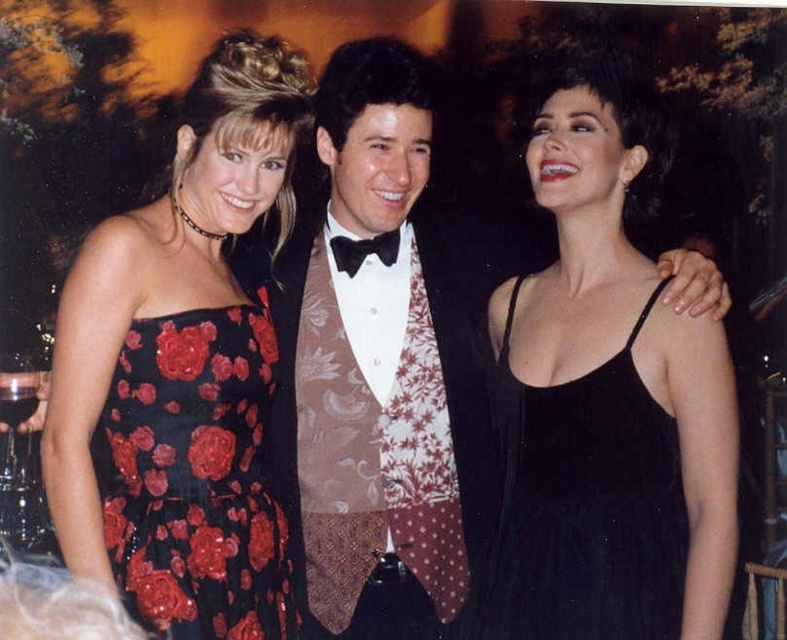
You are a photographer at the event and need to adjust the lighting to ensure both the black satin dress at center and the black velvet dress at center are visible. Which dress requires more light due to its material properties?

The black satin dress at center requires more light because satin reflects more light than velvet, making it appear brighter and thus needing less additional light to be visible. However, since both are black, the satin might need slightly less light adjustment compared to velvet which absorbs more light.

You are a photographer at the event and need to adjust the lighting for the black satin dress at center and the black velvet dress at center. Which dress should you focus on first if you want to start with the one further to the left?

The black velvet dress at center is further to the left, so you should focus on it first.

Based on the photo, you are a photographer at the event and need to adjust the lighting to ensure both the black satin dress at left and the black sequined dress at left are equally highlighted. Considering their widths, which dress requires a wider light beam to cover its entirety?

The black satin dress at left requires a wider light beam because its width surpasses that of the black sequined dress at left.